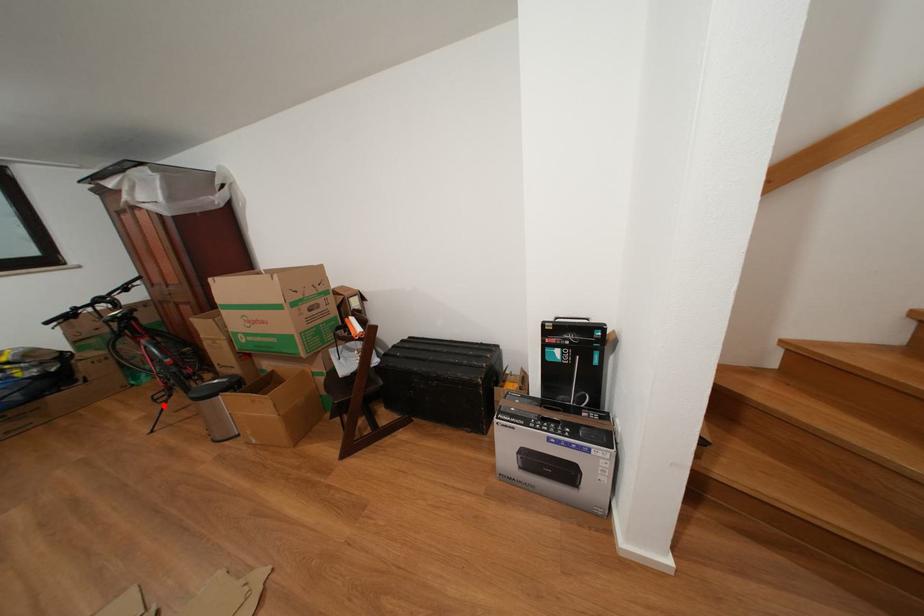
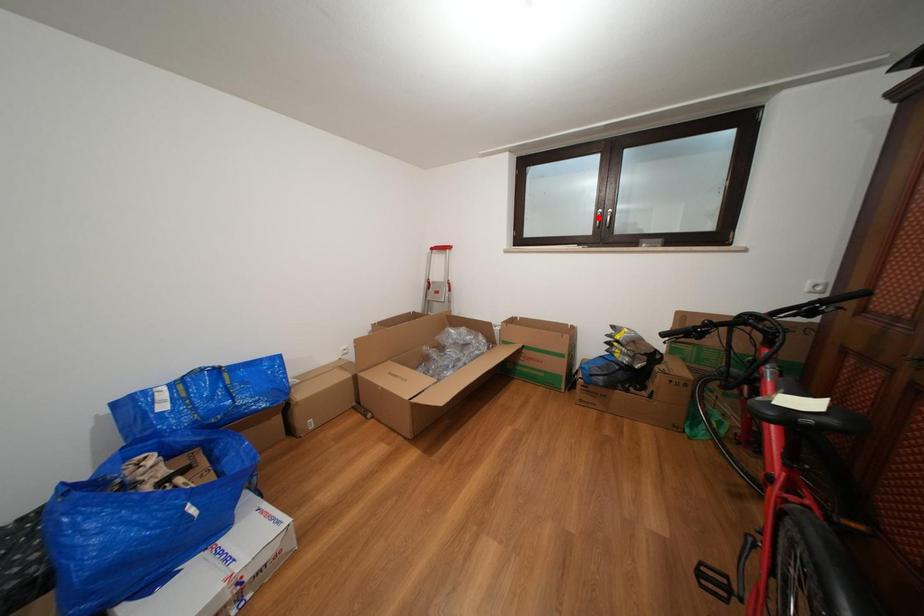
I am providing you with two images of the same scene from different viewpoints. A red point is marked on the first image and another point is marked on the second image. Do the highlighted points in image1 and image2 indicate the same real-world spot?

No